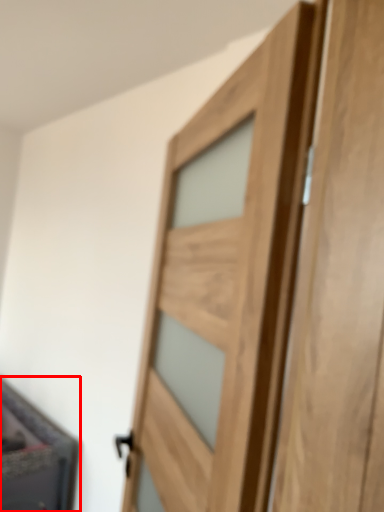
Question: From the image's perspective, where is cabinetry (annotated by the red box) located relative to door?

Choices:
 (A) above
 (B) below

Answer: (B)